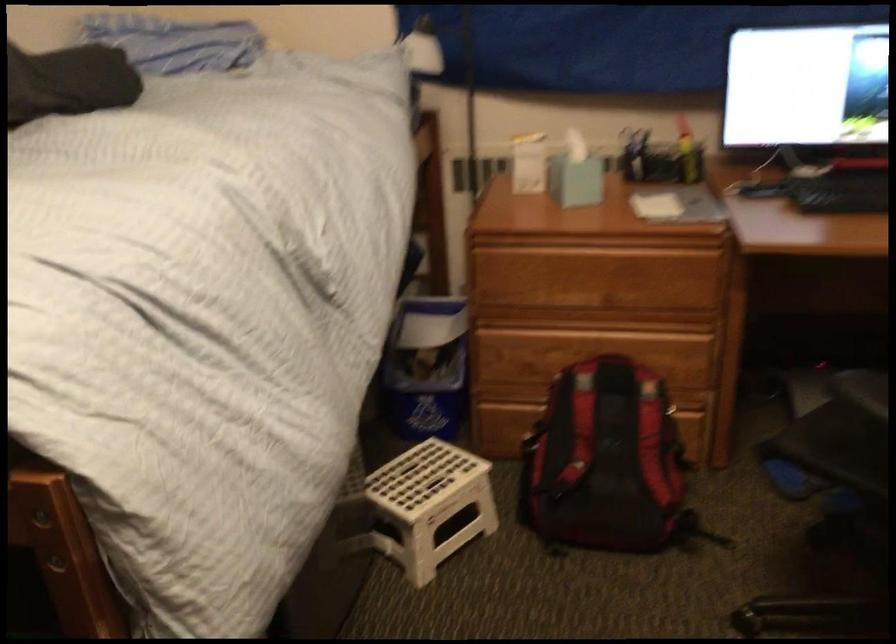
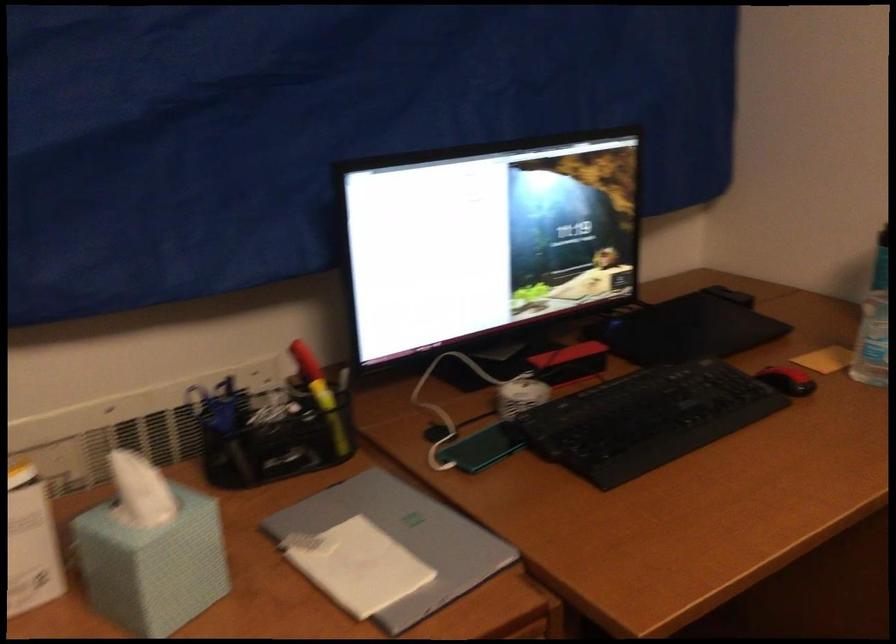
The point at (685, 145) is marked in the first image. Where is the corresponding point in the second image?

(321, 395)